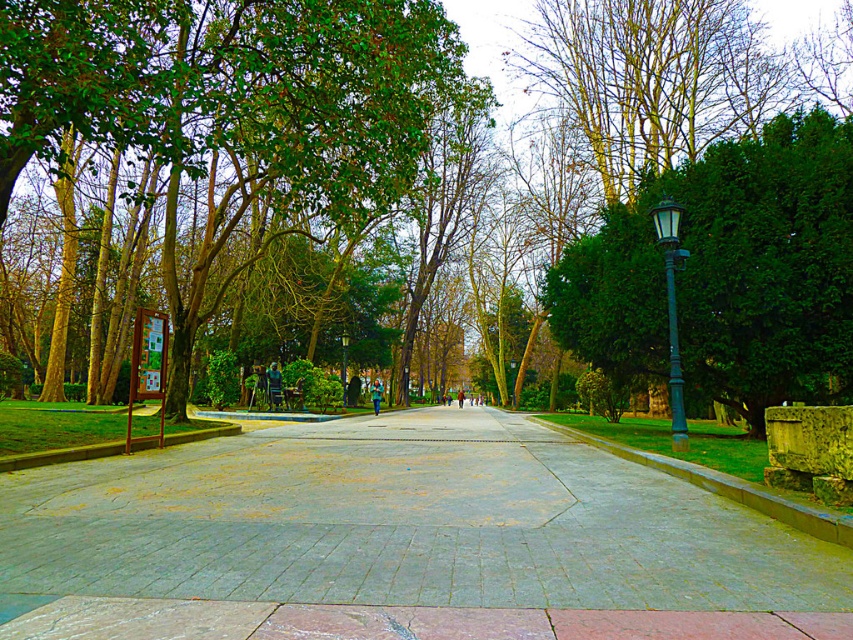
You are walking along the central pathway in the park and notice both the green leafy tree at right and the green matte lamp post at right. Which object is wider?

The green leafy tree at right is wider than the green matte lamp post at right according to the description.

You are a park visitor wanting to take a photo of the green leafy tree at right and the green matte lamp post at right from a distance where both are fully visible. Considering their heights, which object should you position closer to in order to frame both properly?

The green leafy tree at right is taller than the green matte lamp post at right. To frame both properly, position yourself closer to the taller green leafy tree at right so that the shorter lamp post doesn

You are walking along the park pathway and want to take a photo of both the green leafy tree at right and the green matte lamp post at right. However, you notice that one is blocking the other. Which object is blocking the other?

The green leafy tree at right is blocking the green matte lamp post at right because the lamp post is behind the tree.